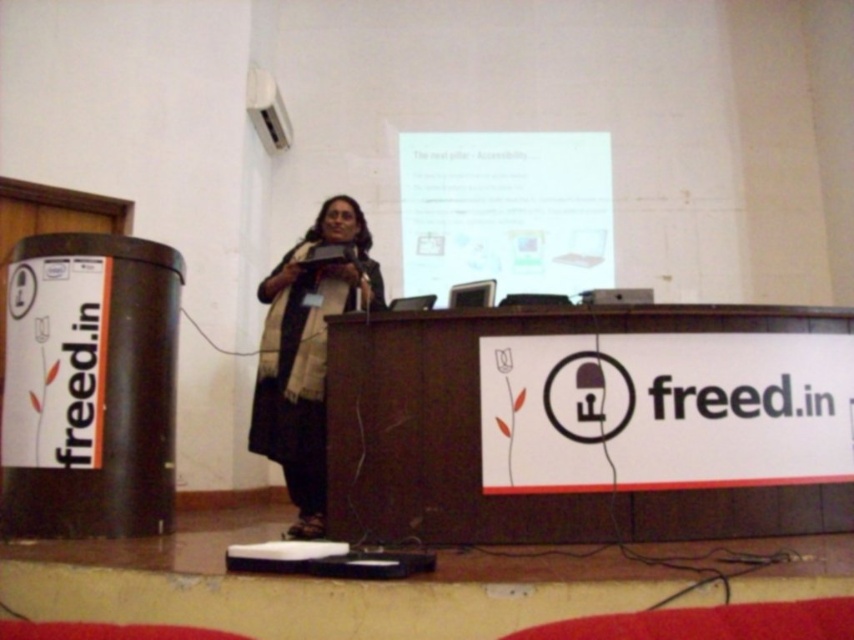
Based on the scene description, can you determine which object is shorter between the white glossy projector screen at upper center and the dark gray scarf at center?

The white glossy projector screen at upper center is not as tall as the dark gray scarf at center, so the projector screen is shorter.

You are an attendee at the presentation and want to take a photo of the presenter. However, you notice that the white glossy projector screen at upper center and the dark gray scarf at center might be in your shot. Which one is to the right of the other?

The white glossy projector screen at upper center is positioned on the right side of dark gray scarf at center, so the projector screen is to the right of the scarf.